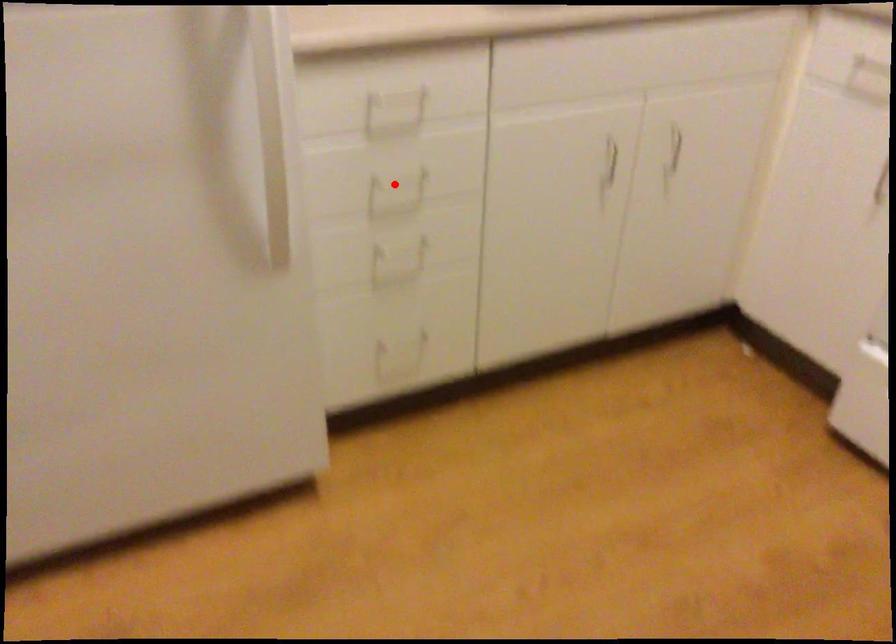
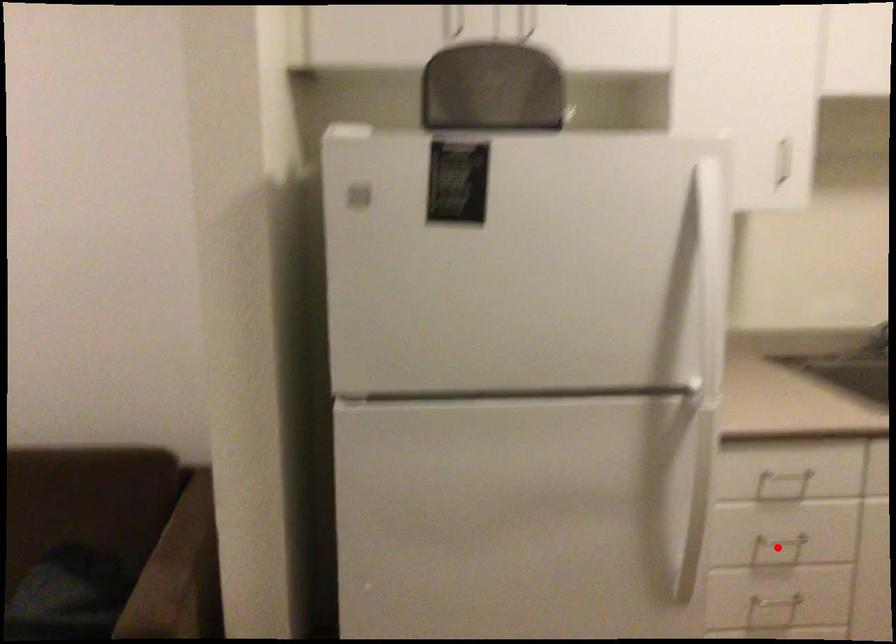
I am providing you with two images of the same scene from different viewpoints. A red point is marked on the first image and another point is marked on the second image. Does the point marked in image1 correspond to the same location as the one in image2?

Yes